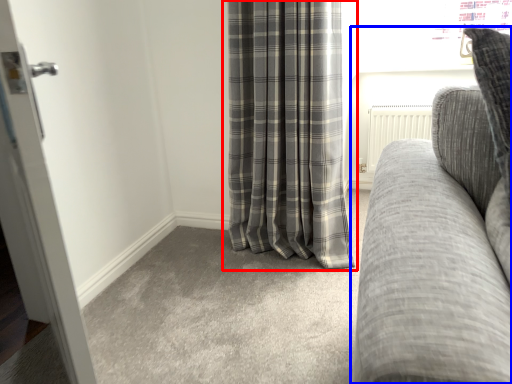
Question: Which point is further to the camera, curtain (highlighted by a red box) or studio couch (highlighted by a blue box)?

Choices:
 (A) curtain
 (B) studio couch

Answer: (A)